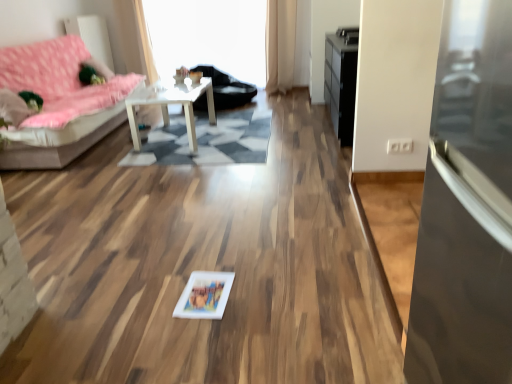
This screenshot has width=512, height=384. I want to click on free space to the left of white glossy picture frame at center, so click(x=152, y=296).